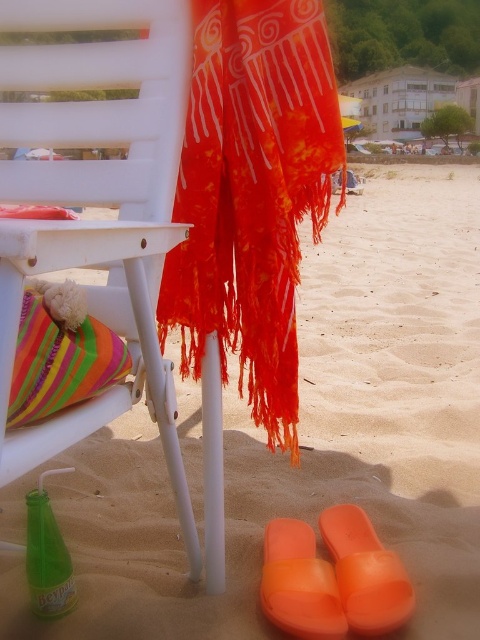
Between striped fabric pillow at lower left and green glass bottle at lower left, which one appears on the right side from the viewer's perspective?

striped fabric pillow at lower left is more to the right.

Who is more forward, (x=57, y=324) or (x=34, y=490)?

Point (x=57, y=324) is in front.

The height and width of the screenshot is (640, 480). What are the coordinates of `striped fabric pillow at lower left` in the screenshot? It's located at pos(60,355).

Is white plastic chair at upper left to the left of green glass bottle at lower left from the viewer's perspective?

In fact, white plastic chair at upper left is to the right of green glass bottle at lower left.

Between white plastic chair at upper left and green glass bottle at lower left, which one is positioned higher?

white plastic chair at upper left is higher up.

Is point (177, 38) closer to viewer compared to point (35, 593)?

Yes, it is in front of point (35, 593).

Find the location of `white plastic chair at upper left`. white plastic chair at upper left is located at coordinates (107, 224).

Is point (204, 452) behind point (312, 612)?

Yes.

Can you confirm if white plastic chair at upper left is positioned below orange rubber sandal at lower right?

No.

Between point (187, 64) and point (310, 589), which one is positioned in front?

Point (187, 64) is in front.

Identify the location of white plastic chair at upper left. (107, 224).